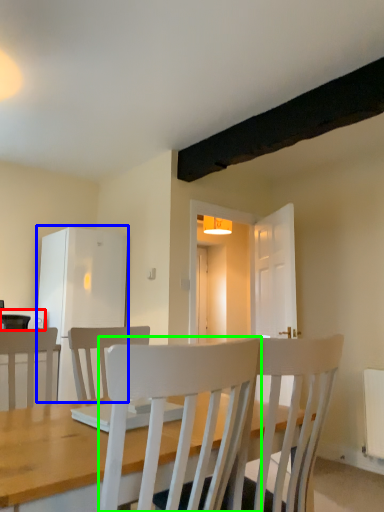
Question: Which object is the closest to the appliance (highlighted by a red box)? Choose among these: fridge (highlighted by a blue box) or chair (highlighted by a green box).

Choices:
 (A) fridge
 (B) chair

Answer: (A)